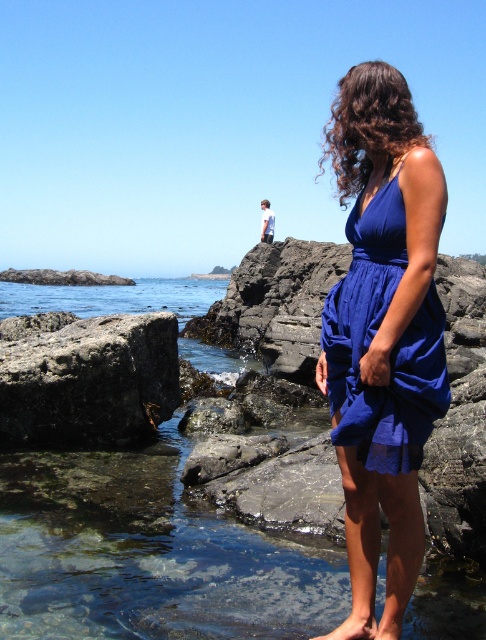
Question: Is blue fabric dress at center wider than clear water at lower left?

Choices:
 (A) yes
 (B) no

Answer: (B)

Question: Which point is farther from the camera taking this photo?

Choices:
 (A) (117, 324)
 (B) (68, 296)
 (C) (102, 481)

Answer: (B)

Question: Can you confirm if blue silk dress at center is positioned to the left of rusty metal rock at lower left?

Choices:
 (A) yes
 (B) no

Answer: (B)

Question: Which object is closer to the camera taking this photo?

Choices:
 (A) clear water at lower left
 (B) blue silk dress at center

Answer: (B)

Question: Estimate the real-world distances between objects in this image. Which object is closer to the blue fabric dress at center?

Choices:
 (A) clear water at rock center
 (B) blue silk dress at center
 (C) clear water at lower left
 (D) rusty metal rock at lower left

Answer: (B)

Question: Where is clear water at rock center located in relation to blue silk dress at center in the image?

Choices:
 (A) below
 (B) above

Answer: (A)